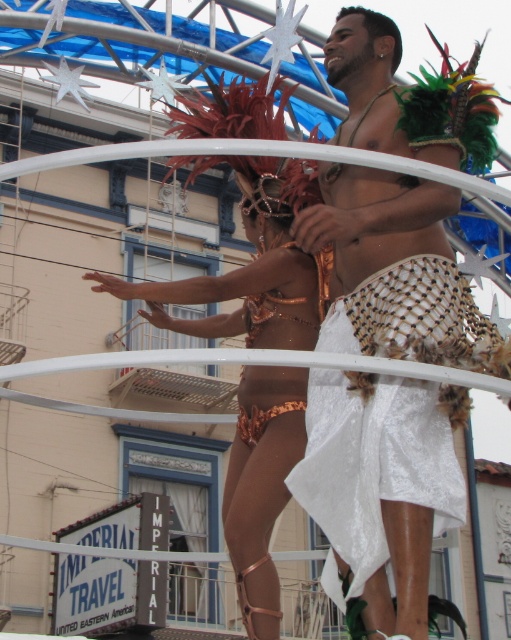
Question: Can you confirm if white mesh skirt at center is bigger than copper metallic bikini at center?

Choices:
 (A) yes
 (B) no

Answer: (B)

Question: Can you confirm if white mesh skirt at center is thinner than copper metallic bikini at center?

Choices:
 (A) yes
 (B) no

Answer: (A)

Question: Which point is closer to the camera?

Choices:
 (A) (407, 472)
 (B) (252, 632)

Answer: (A)

Question: Among these points, which one is farthest from the camera?

Choices:
 (A) (384, 496)
 (B) (103, 276)

Answer: (B)

Question: Is white mesh skirt at center thinner than copper metallic bikini at center?

Choices:
 (A) no
 (B) yes

Answer: (B)

Question: Which point is farther to the camera?

Choices:
 (A) (443, 332)
 (B) (269, 212)

Answer: (B)